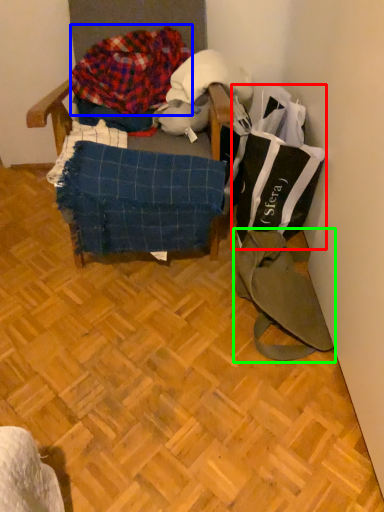
Question: Which object is positioned closest to grocery bag (highlighted by a red box)? Select from waste (highlighted by a blue box) and messenger bag (highlighted by a green box).

Choices:
 (A) waste
 (B) messenger bag

Answer: (B)